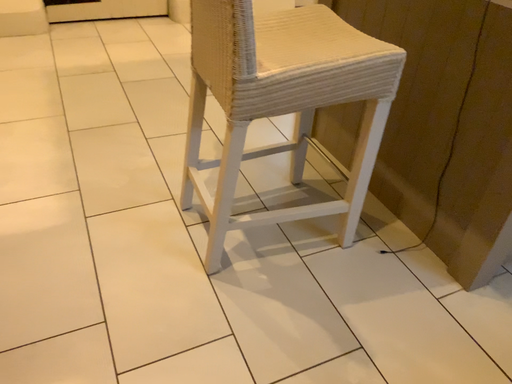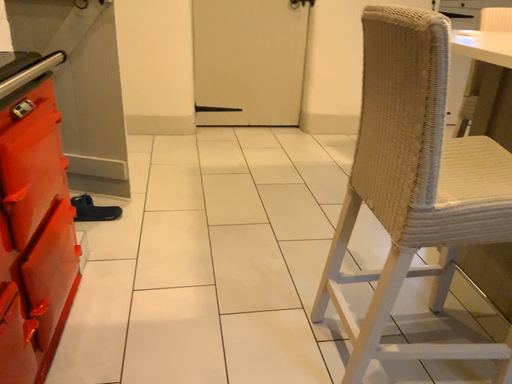
Question: Which way did the camera rotate in the video?

Choices:
 (A) rotated downward
 (B) rotated upward

Answer: (B)